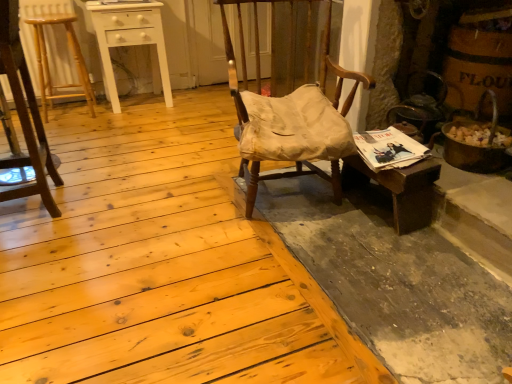
In order to click on vacant area situated below white wood table at upper left (from a real-world perspective) in this screenshot , I will do `click(141, 103)`.